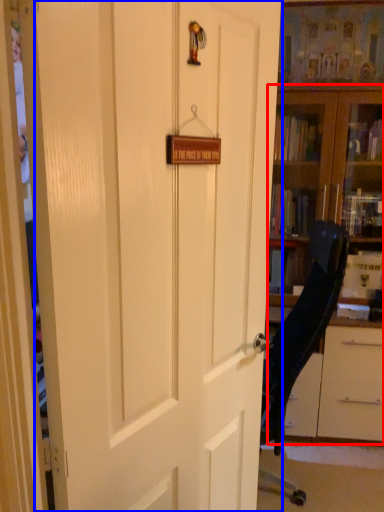
Question: Which object appears farthest to the camera in this image, bookcase (highlighted by a red box) or door (highlighted by a blue box)?

Choices:
 (A) bookcase
 (B) door

Answer: (A)